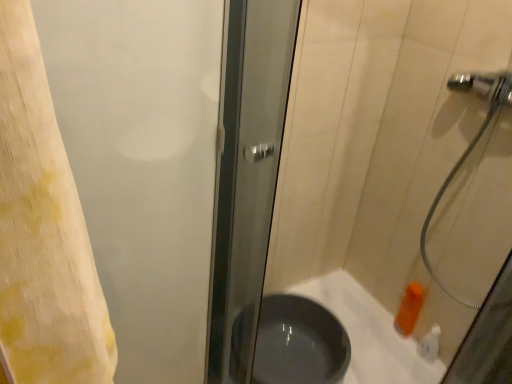
Question: In terms of width, does white plastic bottle at lower right look wider or thinner when compared to frosted glass screen door at left?

Choices:
 (A) thin
 (B) wide

Answer: (A)

Question: Is white plastic bottle at lower right to the left or to the right of frosted glass screen door at left in the image?

Choices:
 (A) left
 (B) right

Answer: (B)

Question: Considering the real-world distances, which object is farthest from the white plastic bottle at lower right?

Choices:
 (A) frosted glass screen door at left
 (B) matte gray bath at lower right
 (C) matte black basin at center

Answer: (A)

Question: Which is farther from the white plastic bottle at lower right?

Choices:
 (A) matte black basin at center
 (B) frosted glass screen door at left
 (C) matte gray bath at lower right

Answer: (B)